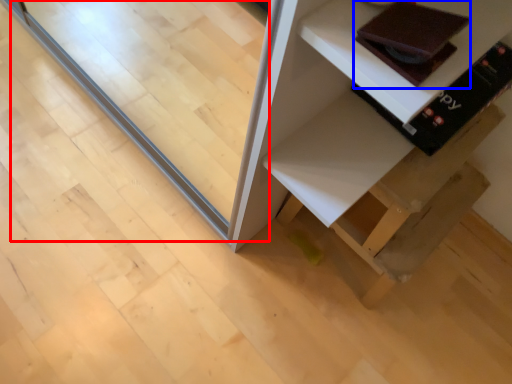
Question: Which of the following is the farthest to the observer, glass door (highlighted by a red box) or book (highlighted by a blue box)?

Choices:
 (A) glass door
 (B) book

Answer: (A)